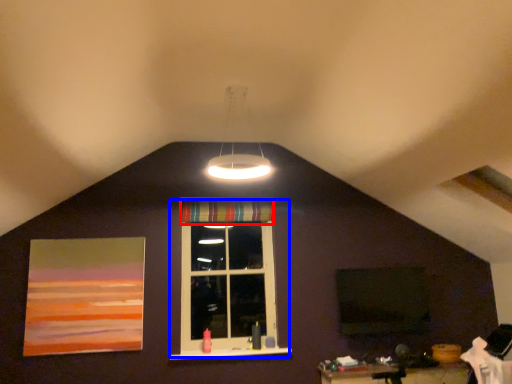
Question: Which of the following is the farthest to the observer, curtain (highlighted by a red box) or window (highlighted by a blue box)?

Choices:
 (A) curtain
 (B) window

Answer: (A)